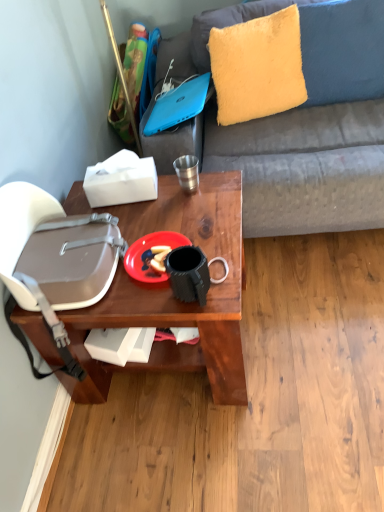
The height and width of the screenshot is (512, 384). Find the location of `free space in front of metallic silver cup at center`. free space in front of metallic silver cup at center is located at coordinates (193, 210).